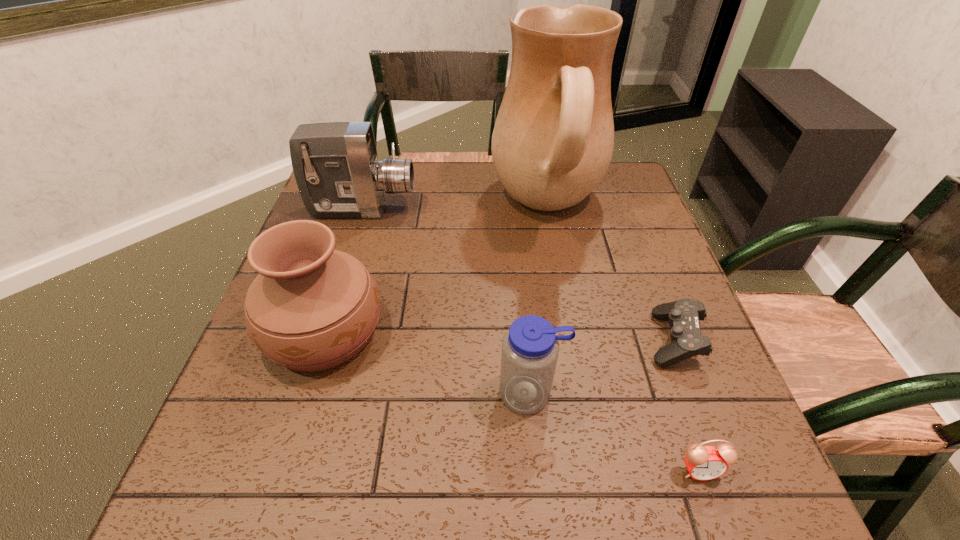
Where is `cream pitcher`? This screenshot has width=960, height=540. cream pitcher is located at coordinates (553, 140).

Identify the location of camcorder. (335, 164).

Identify the location of urn. The width and height of the screenshot is (960, 540). (311, 308).

Where is `water bottle`? Image resolution: width=960 pixels, height=540 pixels. water bottle is located at coordinates (530, 348).

This screenshot has width=960, height=540. In order to click on alarm clock in this screenshot , I will do `click(704, 463)`.

This screenshot has height=540, width=960. What are the coordinates of `the second shortest object` in the screenshot? It's located at (704, 463).

Locate an element on the screen. The image size is (960, 540). the shortest object is located at coordinates (683, 315).

Where is `vacant space situated at the spout of the tallest object`? vacant space situated at the spout of the tallest object is located at coordinates (397, 207).

This screenshot has width=960, height=540. Identify the location of blank space located at the spout of the tallest object. (372, 207).

The width and height of the screenshot is (960, 540). Identify the location of blank space located 0.160m at the spout of the tallest object. (433, 207).